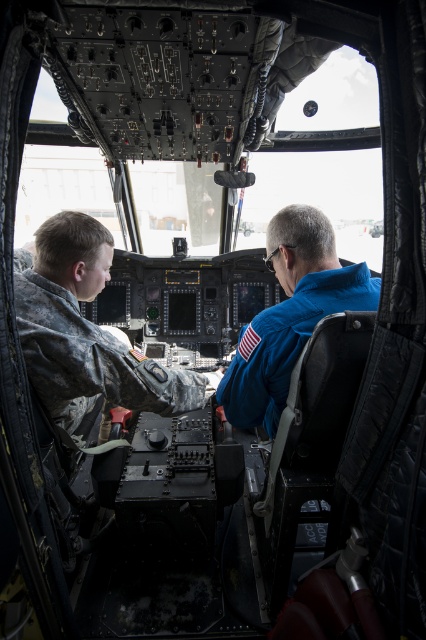
Who is shorter, camouflage fabric uniform at left or blue smooth jacket at center?

camouflage fabric uniform at left

In the scene shown: Is camouflage fabric uniform at left below blue smooth jacket at center?

Indeed, camouflage fabric uniform at left is positioned under blue smooth jacket at center.

Image resolution: width=426 pixels, height=640 pixels. Find the location of `camouflage fabric uniform at left`. camouflage fabric uniform at left is located at coordinates (88, 332).